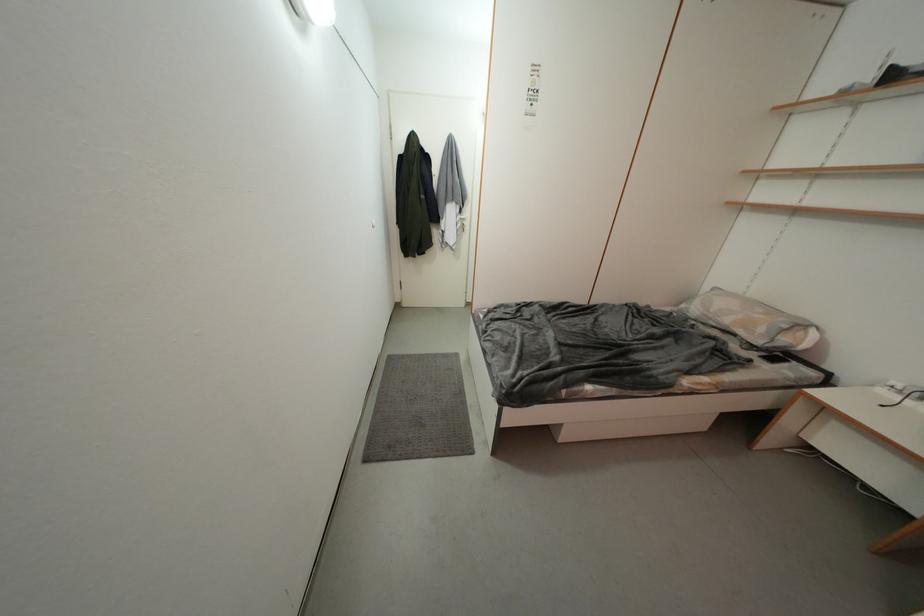
This screenshot has height=616, width=924. What do you see at coordinates (459, 222) in the screenshot?
I see `the white door handle` at bounding box center [459, 222].